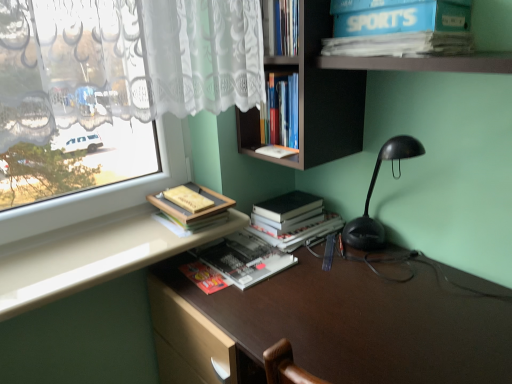
Find the location of a particular element. vacant space situated above matte yellow book at upper left, arranged as the 2th book when viewed from the top (from a real-world perspective) is located at coordinates (x=183, y=193).